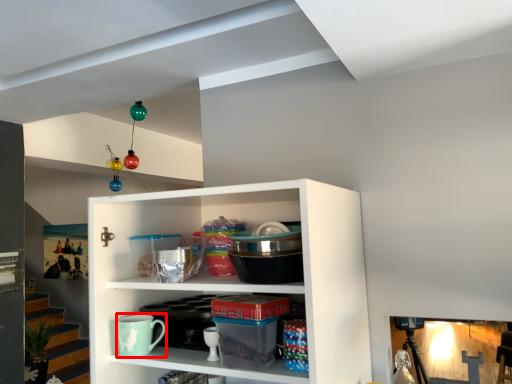
Question: From the image's perspective, where is mug (annotated by the red box) located relative to cabinet?

Choices:
 (A) above
 (B) below

Answer: (B)